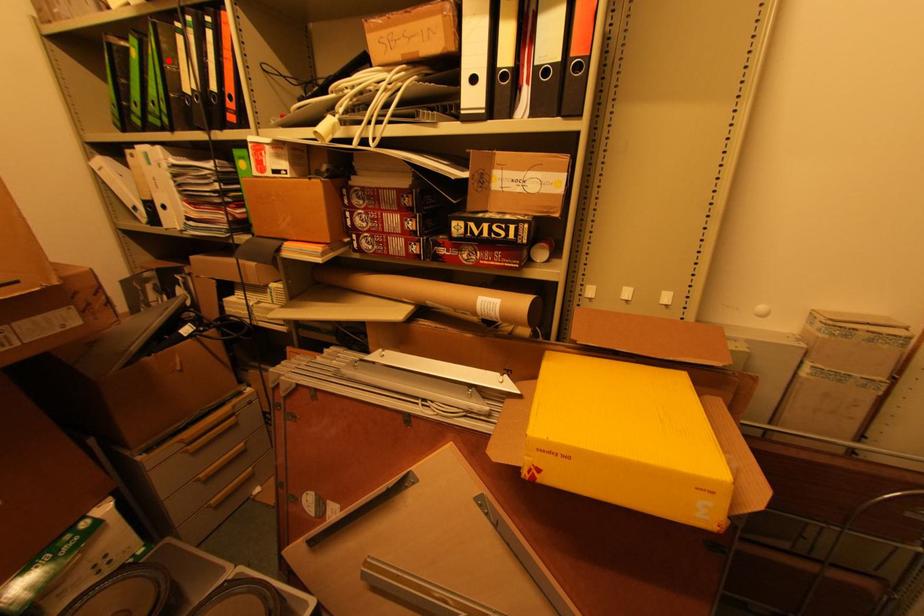
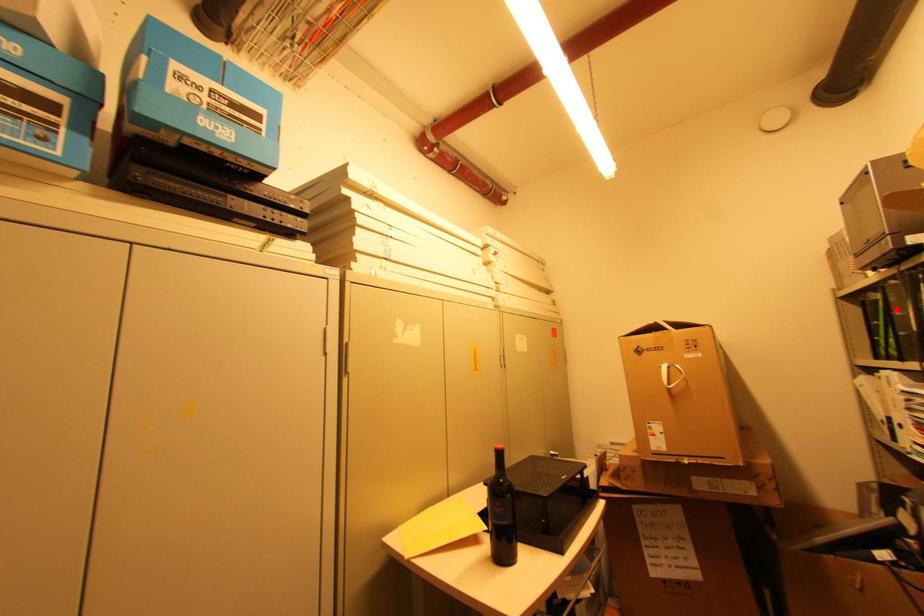
I am providing you with two images of the same scene from different viewpoints. A red point is marked on the first image and another point is marked on the second image. Are the points marked in image1 and image2 representing the same 3D position?

Yes